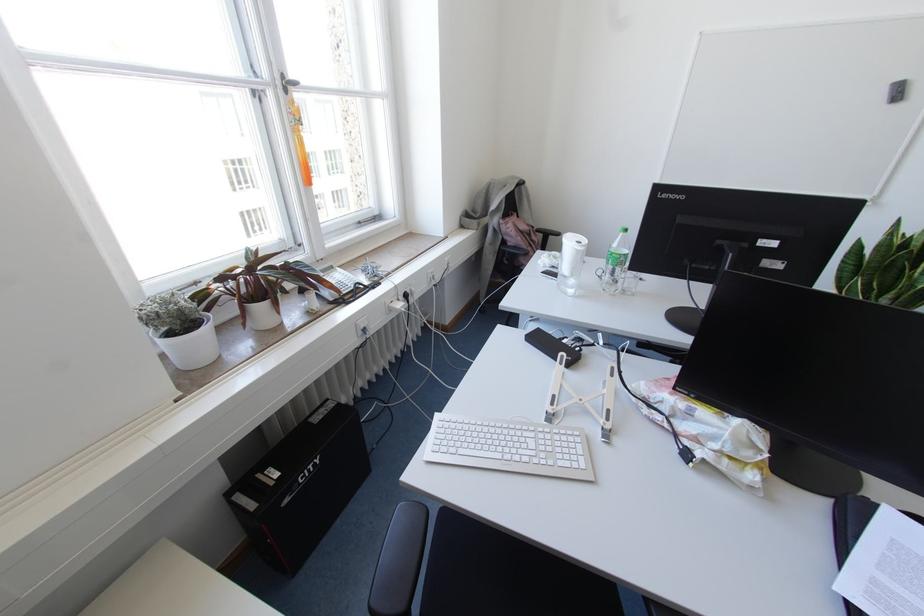
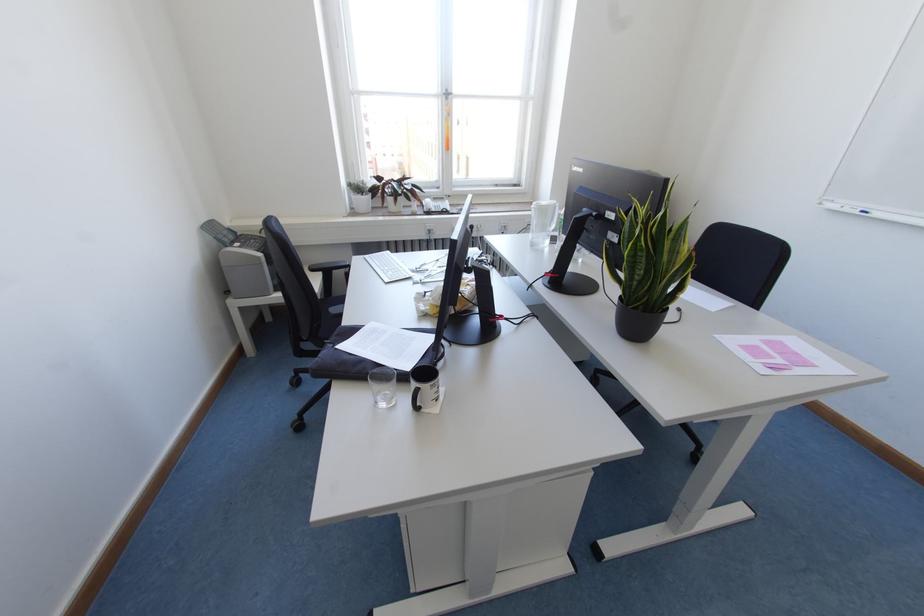
The point at (285,90) is marked in the first image. Where is the corresponding point in the second image?

(446, 98)